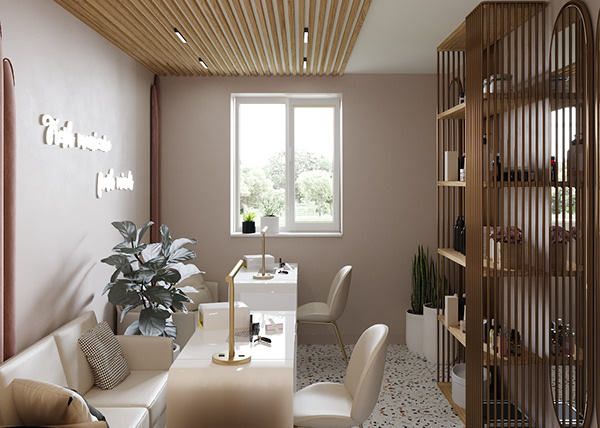
Where is `window`? The width and height of the screenshot is (600, 428). window is located at coordinates (311, 122).